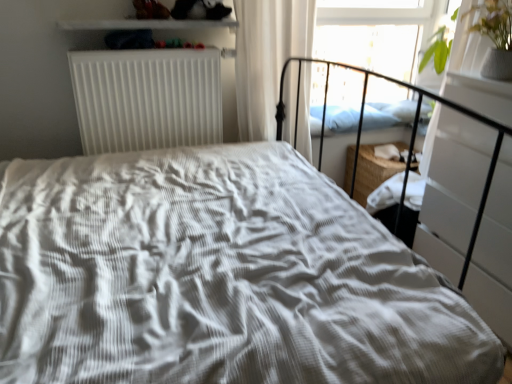
Question: Considering the relative sizes of white glossy shelf at upper center and white matte radiator at upper left in the image provided, is white glossy shelf at upper center thinner than white matte radiator at upper left?

Choices:
 (A) yes
 (B) no

Answer: (B)

Question: Is white matte radiator at upper left completely or partially inside white glossy shelf at upper center?

Choices:
 (A) no
 (B) yes

Answer: (A)

Question: Does white glossy shelf at upper center have a smaller size compared to white matte radiator at upper left?

Choices:
 (A) no
 (B) yes

Answer: (B)

Question: From the image's perspective, does white glossy shelf at upper center appear lower than white matte radiator at upper left?

Choices:
 (A) no
 (B) yes

Answer: (A)

Question: From a real-world perspective, does white glossy shelf at upper center stand above white matte radiator at upper left?

Choices:
 (A) no
 (B) yes

Answer: (B)

Question: Is white matte radiator at upper left at the back of white glossy shelf at upper center?

Choices:
 (A) no
 (B) yes

Answer: (A)

Question: Can you confirm if transparent glass window screen at upper right is wider than blue soft pillow at upper right?

Choices:
 (A) yes
 (B) no

Answer: (B)

Question: From the image's perspective, is transparent glass window screen at upper right on blue soft pillow at upper right?

Choices:
 (A) no
 (B) yes

Answer: (B)

Question: Is transparent glass window screen at upper right at the left side of blue soft pillow at upper right?

Choices:
 (A) no
 (B) yes

Answer: (A)

Question: Is transparent glass window screen at upper right oriented towards blue soft pillow at upper right?

Choices:
 (A) no
 (B) yes

Answer: (B)

Question: Is transparent glass window screen at upper right outside blue soft pillow at upper right?

Choices:
 (A) yes
 (B) no

Answer: (A)

Question: Is transparent glass window screen at upper right touching blue soft pillow at upper right?

Choices:
 (A) yes
 (B) no

Answer: (B)

Question: Is white sheer curtain at upper right thinner than blue soft pillow at upper right?

Choices:
 (A) yes
 (B) no

Answer: (A)